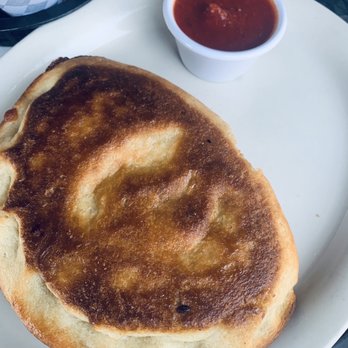
The image size is (348, 348). In order to click on black bowl in this screenshot , I will do `click(33, 19)`.